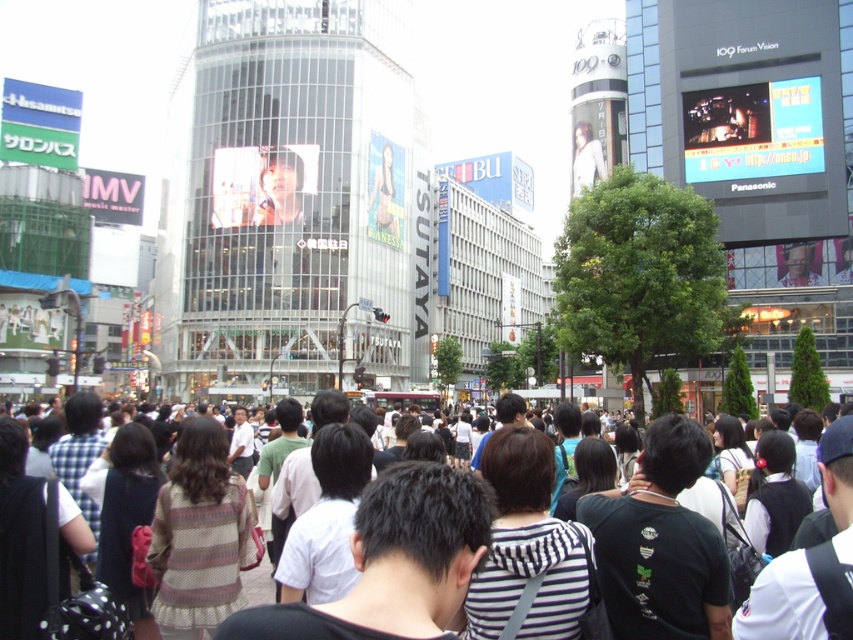
Between point (262, 179) and point (265, 566), which one is positioned behind?

The point (262, 179) is behind.

Can you confirm if smooth skin face at center is positioned to the left of white cotton shirt at center?

Yes, smooth skin face at center is to the left of white cotton shirt at center.

This screenshot has height=640, width=853. What do you see at coordinates (280, 188) in the screenshot?
I see `smooth skin face at center` at bounding box center [280, 188].

Where is `smooth skin face at center`? smooth skin face at center is located at coordinates (280, 188).